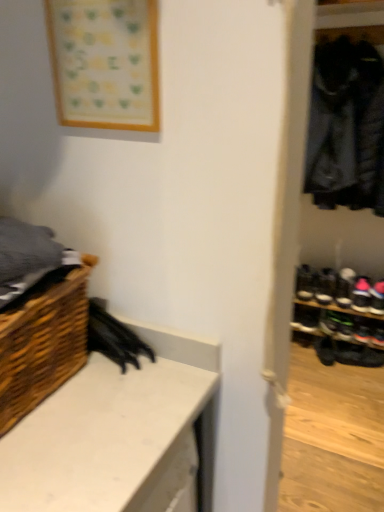
Question: Choose the correct answer: Is black leather shoe at right, which is the 3th footwear from top to bottom, inside black leather shoe at lower right, which appears as the first footwear when ordered from the bottom, or outside it?

Choices:
 (A) outside
 (B) inside

Answer: (A)

Question: From their relative heights in the image, would you say black leather shoe at right, which is the 3th footwear from top to bottom, is taller or shorter than black leather shoe at lower right, which appears as the first footwear when ordered from the bottom?

Choices:
 (A) short
 (B) tall

Answer: (A)

Question: Which object is the farthest from the woven wood basket at lower left?

Choices:
 (A) white matte counter at lower left
 (B) black leather shoe at right, which is the 3th footwear from top to bottom
 (C) wooden frame at upper left
 (D) black suede shoe at lower right, the first footwear viewed from the top
 (E) black suede shoe at right, which appears as the 3th footwear when ordered from the bottom

Answer: (B)

Question: Which is farther from the black leather shoe at right, which is the 3th footwear from top to bottom?

Choices:
 (A) black leather shoe at lower right, which appears as the first footwear when ordered from the bottom
 (B) white matte counter at lower left
 (C) black suede shoe at lower right, the first footwear viewed from the top
 (D) woven wood basket at lower left
 (E) wooden frame at upper left

Answer: (E)